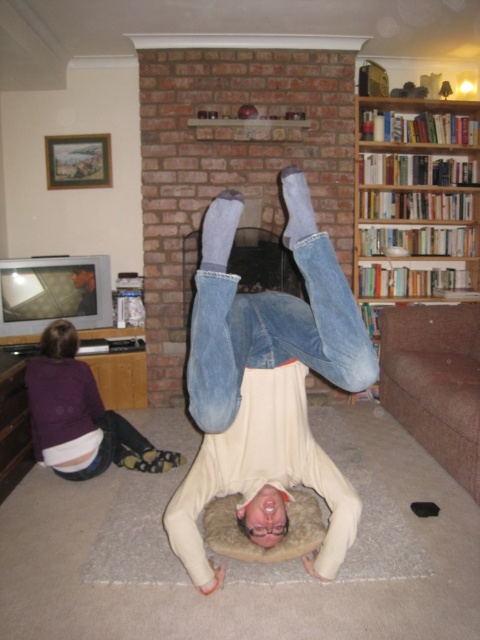
Which is below, white cotton shirt at center or smooth plastic remote at lower left?

white cotton shirt at center

Is point (336, 301) closer to viewer compared to point (84, 307)?

That is True.

This screenshot has height=640, width=480. What do you see at coordinates (266, 388) in the screenshot?
I see `white cotton shirt at center` at bounding box center [266, 388].

Locate an element on the screen. The image size is (480, 640). white cotton shirt at center is located at coordinates (266, 388).

Between purple fleece sweater at lower left and smooth plastic remote at lower left, which one appears on the left side from the viewer's perspective?

From the viewer's perspective, smooth plastic remote at lower left appears more on the left side.

In order to click on purple fleece sweater at lower left in this screenshot , I will do `click(81, 416)`.

Identify the location of purple fleece sweater at lower left. The height and width of the screenshot is (640, 480). tap(81, 416).

Locate an element on the screen. purple fleece sweater at lower left is located at coordinates (81, 416).

Can you confirm if matte gray television at lower left is smaller than smooth plastic remote at lower left?

Incorrect, matte gray television at lower left is not smaller in size than smooth plastic remote at lower left.

Can you confirm if matte gray television at lower left is shorter than smooth plastic remote at lower left?

No, matte gray television at lower left is not shorter than smooth plastic remote at lower left.

Does point (84, 317) come behind point (78, 314)?

Yes, point (84, 317) is farther from viewer.

At what (x,y) coordinates should I click in order to perform the action: click on matte gray television at lower left. Please return your answer as a coordinate pair (x, y). Looking at the image, I should click on (54, 292).